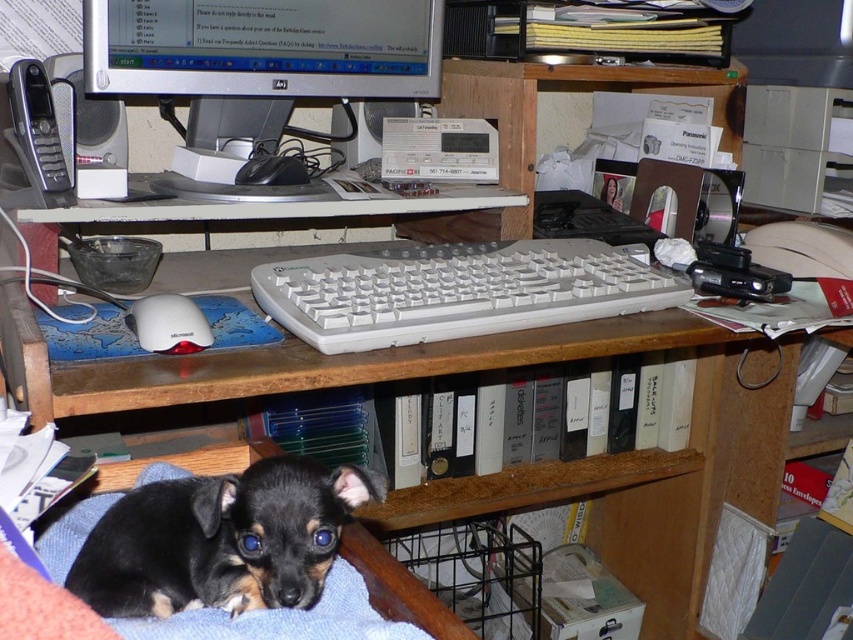
You are organizing a photo shoot and need to ensure all items fit within a rectangular frame. The frame can only accommodate objects up to the size of the matte black monitor at upper center. Will the black fur dog at lower left fit inside the frame?

The black fur dog at lower left is smaller than the matte black monitor at upper center, so it will fit inside the frame designed for the monitor.

Consider the image. You are organizing a photo shoot and need to position the black fur dog at lower left and the matte black monitor at upper center. According to the scene, which object is positioned to the right of the other?

The black fur dog at lower left is to the right of the matte black monitor at upper center.

Please look at the image and locate the point at coordinates (263, 48). What object is positioned at this exact point?

The point at coordinates (263, 48) marks the location of the matte black monitor at upper center.